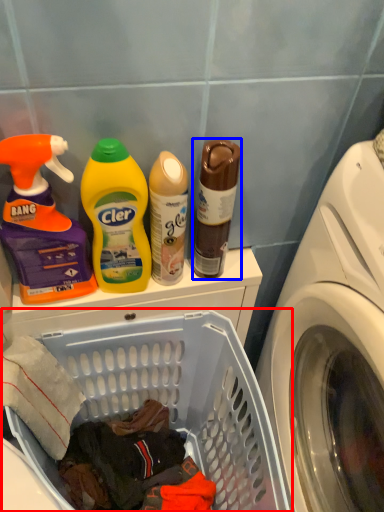
Question: Which object is closer to the camera taking this photo, laundry basket (highlighted by a red box) or bottle (highlighted by a blue box)?

Choices:
 (A) laundry basket
 (B) bottle

Answer: (A)